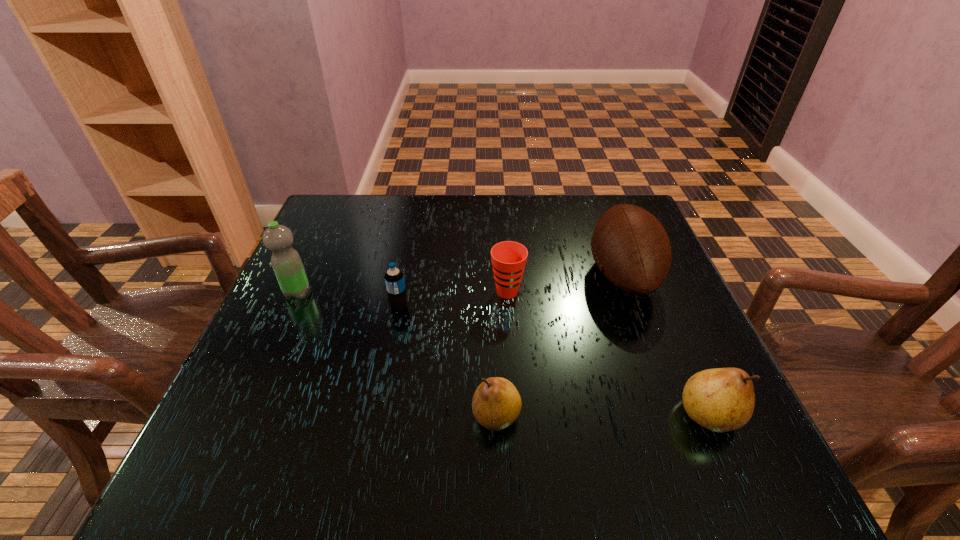
Find the location of a particular element. The width and height of the screenshot is (960, 540). vacant space positioned 0.360m on the laces of the football is located at coordinates [x=435, y=275].

At what (x,y) coordinates should I click in order to perform the action: click on vacant position located on the laces of the football. Please return your answer as a coordinate pair (x, y). The width and height of the screenshot is (960, 540). Looking at the image, I should click on (482, 275).

The height and width of the screenshot is (540, 960). Identify the location of free space located 0.120m on the laces of the football. pyautogui.click(x=538, y=275).

This screenshot has height=540, width=960. In order to click on vacant space positioned on the back of the cup in this screenshot , I will do `click(501, 208)`.

Locate an element on the screen. This screenshot has width=960, height=540. object that is at the far edge is located at coordinates (631, 248).

Identify the location of object located at the left edge. The width and height of the screenshot is (960, 540). pyautogui.click(x=286, y=262).

Where is `pear that is at the right edge`? The height and width of the screenshot is (540, 960). pear that is at the right edge is located at coordinates (722, 399).

Where is `football situated at the right edge`? This screenshot has height=540, width=960. football situated at the right edge is located at coordinates (631, 248).

Find the location of a particular element. This screenshot has height=540, width=960. object that is at the far right corner is located at coordinates (631, 248).

Identify the location of object present at the near right corner. (722, 399).